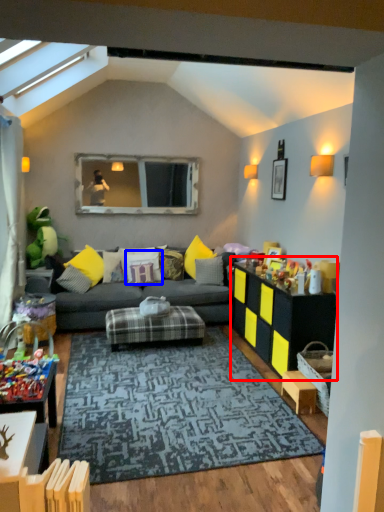
Question: Which object is further to the camera taking this photo, table (highlighted by a red box) or pillow (highlighted by a blue box)?

Choices:
 (A) table
 (B) pillow

Answer: (B)